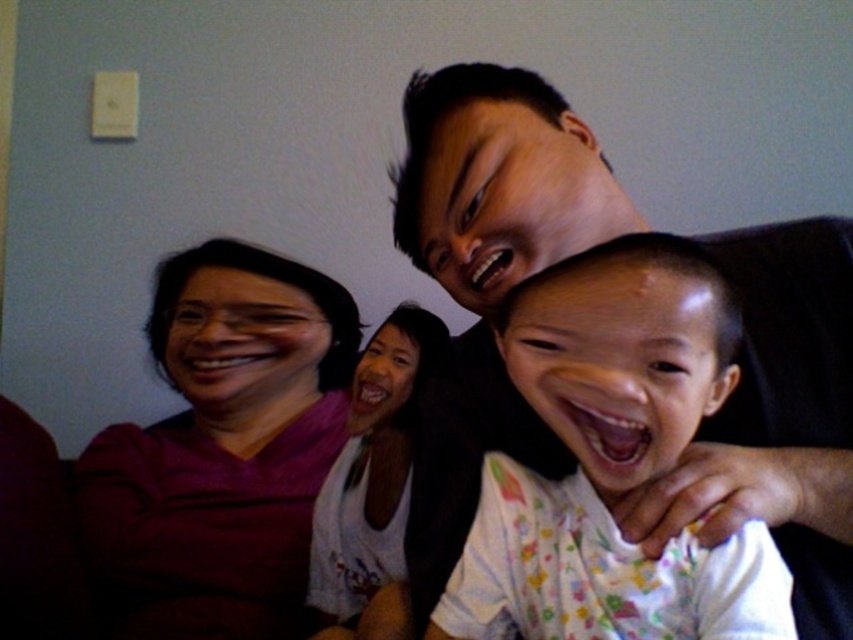
Question: Which point appears farthest from the camera in this image?

Choices:
 (A) (474, 369)
 (B) (322, 579)
 (C) (189, 346)

Answer: (C)

Question: Is black matte shirt at upper right closer to camera compared to white cotton shirt at center?

Choices:
 (A) yes
 (B) no

Answer: (A)

Question: Which object is farther from the camera taking this photo?

Choices:
 (A) white cotton shirt at center
 (B) black matte shirt at upper right

Answer: (A)

Question: Does purple matte shirt at left have a greater width compared to white cotton shirt at center?

Choices:
 (A) yes
 (B) no

Answer: (A)

Question: In this image, where is black matte shirt at upper right located relative to white cotton shirt at center?

Choices:
 (A) right
 (B) left

Answer: (A)

Question: Which point is closer to the camera taking this photo?

Choices:
 (A) (311, 384)
 (B) (770, 394)

Answer: (B)